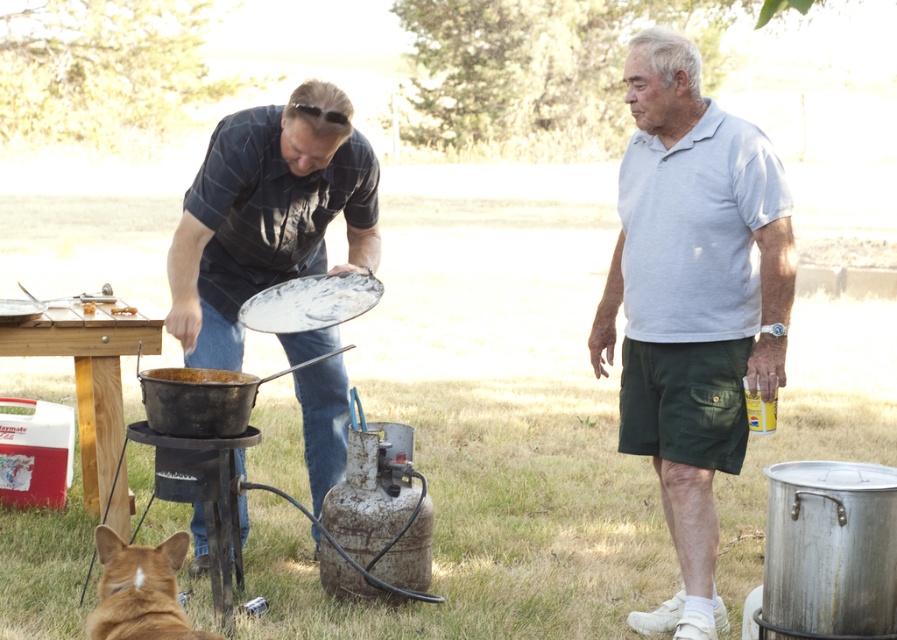
Question: Does dark blue plaid shirt at center have a lesser width compared to wooden picnic table at lower left?

Choices:
 (A) yes
 (B) no

Answer: (B)

Question: Is white cotton shirt at center closer to camera compared to wooden picnic table at lower left?

Choices:
 (A) yes
 (B) no

Answer: (A)

Question: Which point appears closest to the camera in this image?

Choices:
 (A) (106, 588)
 (B) (228, 502)
 (C) (725, 308)
 (D) (361, 182)

Answer: (A)

Question: Which point is farther to the camera?

Choices:
 (A) rusty metal pot at lower left
 (B) white cotton shirt at center
 (C) brown fur at lower left

Answer: (A)

Question: Estimate the real-world distances between objects in this image. Which object is closer to the white cotton shirt at center?

Choices:
 (A) brown fur at lower left
 (B) wooden picnic table at lower left

Answer: (B)

Question: Is white cotton shirt at center below rusty metal pot at lower left?

Choices:
 (A) no
 (B) yes

Answer: (A)